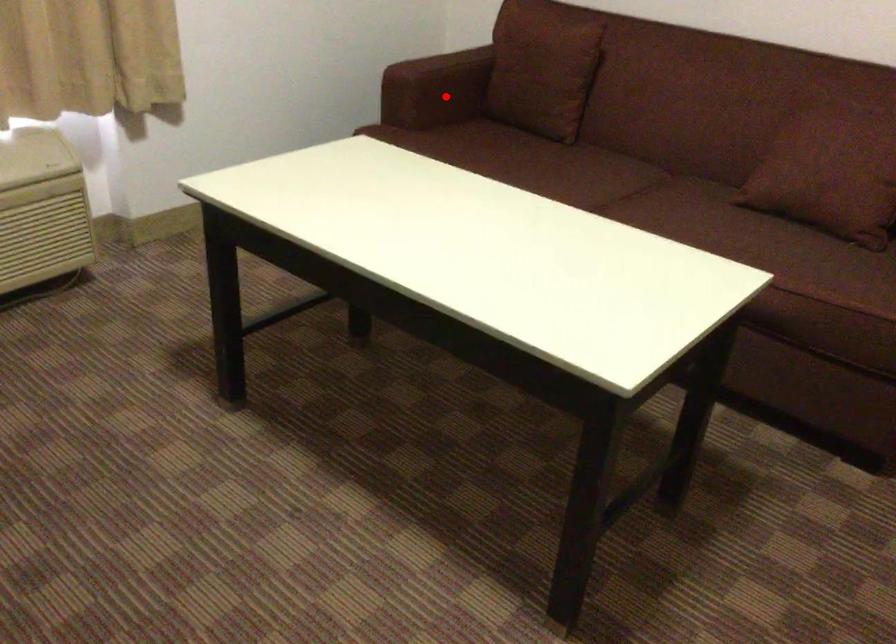
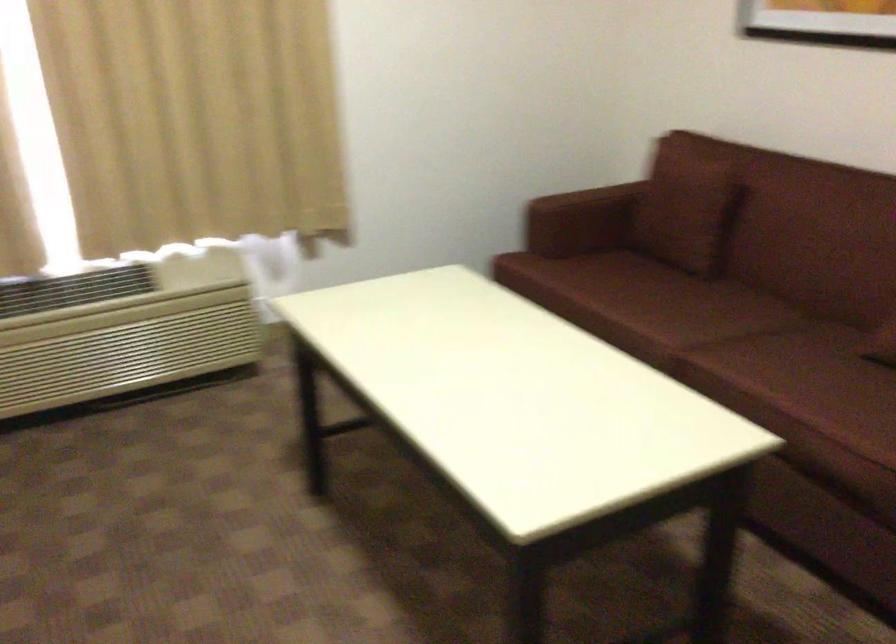
Locate, in the second image, the point that corresponds to the highlighted location in the first image.

(573, 225)